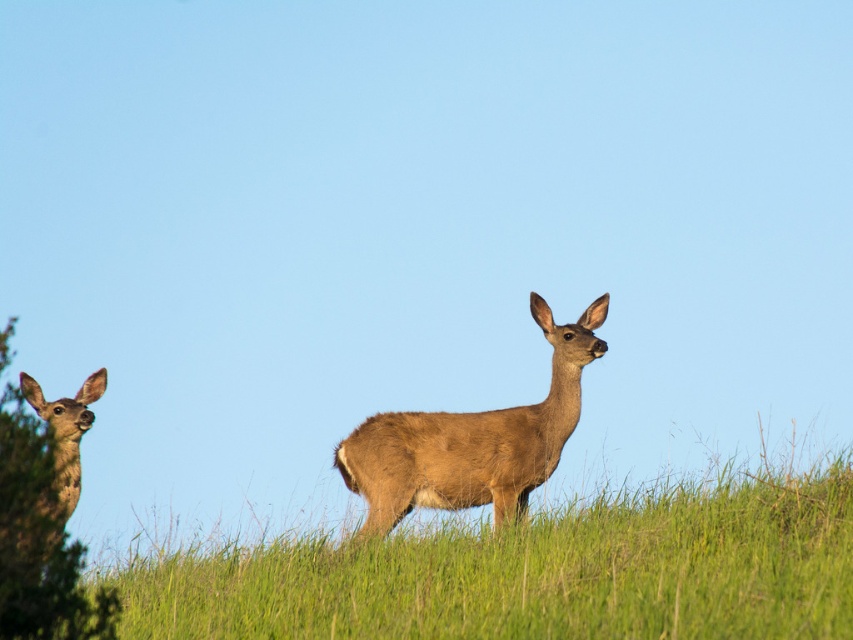
Can you confirm if green grass at center is smaller than brown fuzzy deer at left?

No.

Who is more forward, (612, 513) or (57, 429)?

Point (612, 513) is more forward.

The height and width of the screenshot is (640, 853). What are the coordinates of `green grass at center` in the screenshot? It's located at (531, 572).

Find the location of `brown matte/deer at center`. brown matte/deer at center is located at coordinates point(473,440).

Can you confirm if brown matte/deer at center is positioned above brown fuzzy deer at left?

Yes, brown matte/deer at center is above brown fuzzy deer at left.

Describe the element at coordinates (473, 440) in the screenshot. The image size is (853, 640). I see `brown matte/deer at center` at that location.

In order to click on brown matte/deer at center in this screenshot , I will do `click(473, 440)`.

Measure the distance between point (579, 580) and camera.

Point (579, 580) and camera are 7.18 meters apart from each other.

From the picture: Does green grass at center appear on the left side of brown matte/deer at center?

In fact, green grass at center is to the right of brown matte/deer at center.

Where is `green grass at center`? green grass at center is located at coordinates pos(531,572).

This screenshot has height=640, width=853. What are the coordinates of `green grass at center` in the screenshot? It's located at (531, 572).